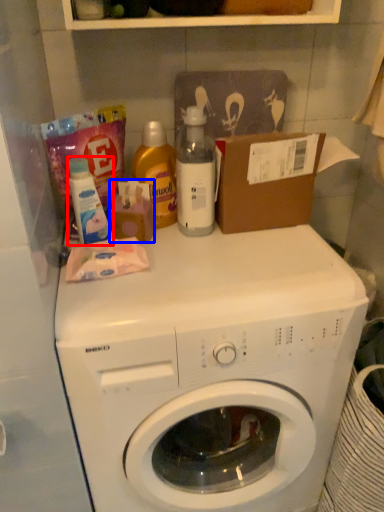
Question: Which object appears closest to the camera in this image, cleaning product (highlighted by a red box) or toiletry (highlighted by a blue box)?

Choices:
 (A) cleaning product
 (B) toiletry

Answer: (A)